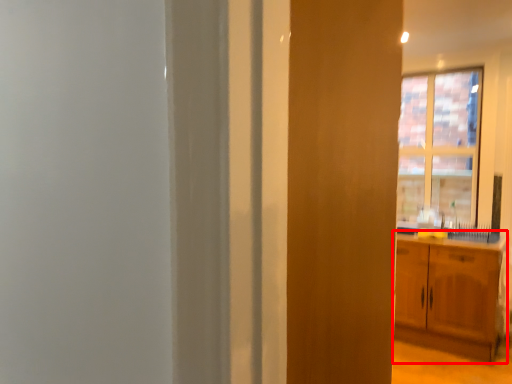
Question: Where is cabinetry (annotated by the red box) located in relation to window in the image?

Choices:
 (A) right
 (B) left

Answer: (B)